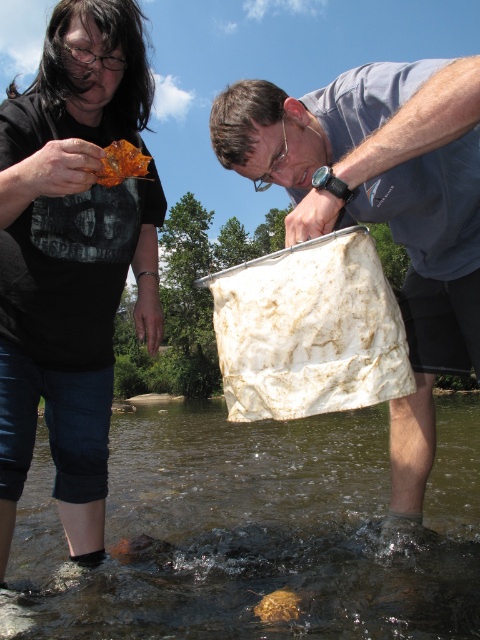
Between translucent plastic bag at lower center and amber glass leaf at upper left, which one appears on the right side from the viewer's perspective?

Positioned to the right is translucent plastic bag at lower center.

I want to click on translucent plastic bag at lower center, so click(x=253, y=531).

Locate an element on the screen. The width and height of the screenshot is (480, 640). translucent plastic bag at lower center is located at coordinates (253, 531).

Find the location of a particular element. The width and height of the screenshot is (480, 640). translucent plastic bag at lower center is located at coordinates (253, 531).

Which is below, translucent plastic bag at lower center or white textured bucket at center?

translucent plastic bag at lower center is below.

Does point (475, 484) come in front of point (474, 230)?

No, (475, 484) is further to viewer.

Does point (277, 451) lie behind point (291, 116)?

Yes, point (277, 451) is farther from viewer.

Identify the location of translucent plastic bag at lower center. The height and width of the screenshot is (640, 480). (253, 531).

Which is more to the right, amber glass leaf at upper left or brown matte rock at lower center?

From the viewer's perspective, brown matte rock at lower center appears more on the right side.

Who is more distant from viewer, (87, 259) or (264, 608)?

Point (87, 259)

The height and width of the screenshot is (640, 480). What are the coordinates of `amber glass leaf at upper left` in the screenshot? It's located at (72, 257).